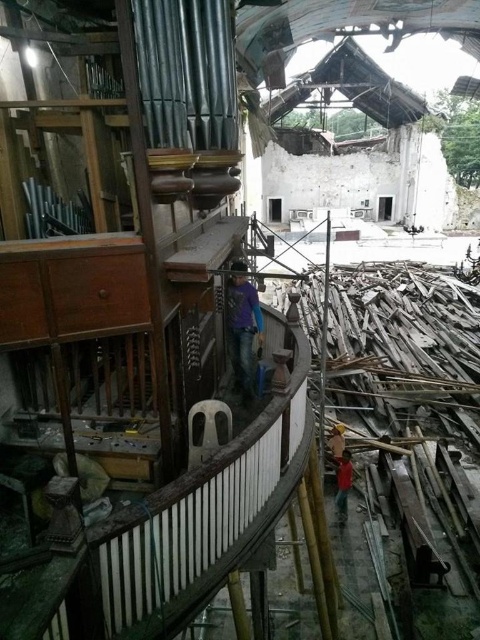
Question: Which of the following is the farthest from the observer?

Choices:
 (A) (340, 509)
 (B) (240, 365)
 (C) (343, 451)

Answer: (C)

Question: Estimate the real-world distances between objects in this image. Which object is farther from the purple matte shirt at center?

Choices:
 (A) red matte shirt at lower right
 (B) yellow hard hat at center

Answer: (A)

Question: Is red matte shirt at lower right thinner than yellow hard hat at center?

Choices:
 (A) no
 (B) yes

Answer: (A)

Question: Is red matte shirt at lower right positioned at the back of yellow hard hat at center?

Choices:
 (A) yes
 (B) no

Answer: (B)

Question: Which is farther from the yellow hard hat at center?

Choices:
 (A) purple matte shirt at center
 (B) red matte shirt at lower right

Answer: (A)

Question: Is the position of red matte shirt at lower right more distant than that of yellow hard hat at center?

Choices:
 (A) no
 (B) yes

Answer: (A)